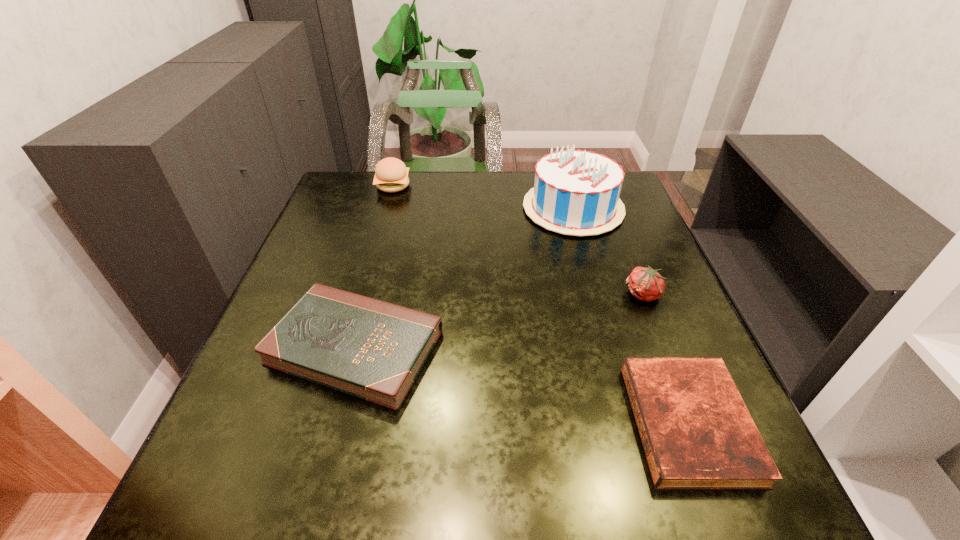
Find the location of a particular element. vacant position located on the front of the second shortest object is located at coordinates (329, 444).

You are a GUI agent. You are given a task and a screenshot of the screen. Output one action in this format:
    pyautogui.click(x=<x>, y=<y>)
    Task: Click on the free space located on the spine side of the right Bible
    The image size is (960, 540).
    Given the screenshot: What is the action you would take?
    pyautogui.click(x=583, y=423)

Where is `vacant area located on the spine side of the right Bible`? The height and width of the screenshot is (540, 960). vacant area located on the spine side of the right Bible is located at coordinates (594, 423).

Find the location of a particular element. The image size is (960, 540). vacant space located on the spine side of the right Bible is located at coordinates [x=546, y=423].

The image size is (960, 540). In order to click on birthday cake at the far edge in this screenshot , I will do `click(576, 192)`.

At what (x,y) coordinates should I click in order to perform the action: click on hamburger that is at the far edge. Please return your answer as a coordinate pair (x, y). The height and width of the screenshot is (540, 960). Looking at the image, I should click on (391, 175).

I want to click on object that is positioned at the near edge, so click(697, 433).

The image size is (960, 540). In order to click on hamburger at the left edge in this screenshot , I will do `click(391, 175)`.

Locate an element on the screen. Bible that is at the left edge is located at coordinates (374, 350).

This screenshot has width=960, height=540. I want to click on birthday cake at the right edge, so click(576, 192).